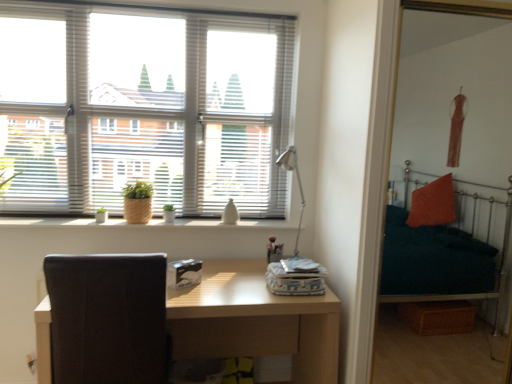
Question: From a real-world perspective, is light brown wooden table at center above or below black leather swivel chair at left?

Choices:
 (A) above
 (B) below

Answer: (B)

Question: From their relative heights in the image, would you say light brown wooden table at center is taller or shorter than black leather swivel chair at left?

Choices:
 (A) tall
 (B) short

Answer: (B)

Question: Which of these objects is positioned closest to the light brown wooden table at center?

Choices:
 (A) teal fabric bunk bed at right
 (B) metallic silver table lamp at center
 (C) black leather swivel chair at left
 (D) wooden textured window sill at center
 (E) white blinds at upper left

Answer: (C)

Question: Which object is positioned farthest from the wooden textured window sill at center?

Choices:
 (A) black leather swivel chair at left
 (B) light brown wooden table at center
 (C) metallic silver table lamp at center
 (D) white blinds at upper left
 (E) teal fabric bunk bed at right

Answer: (E)